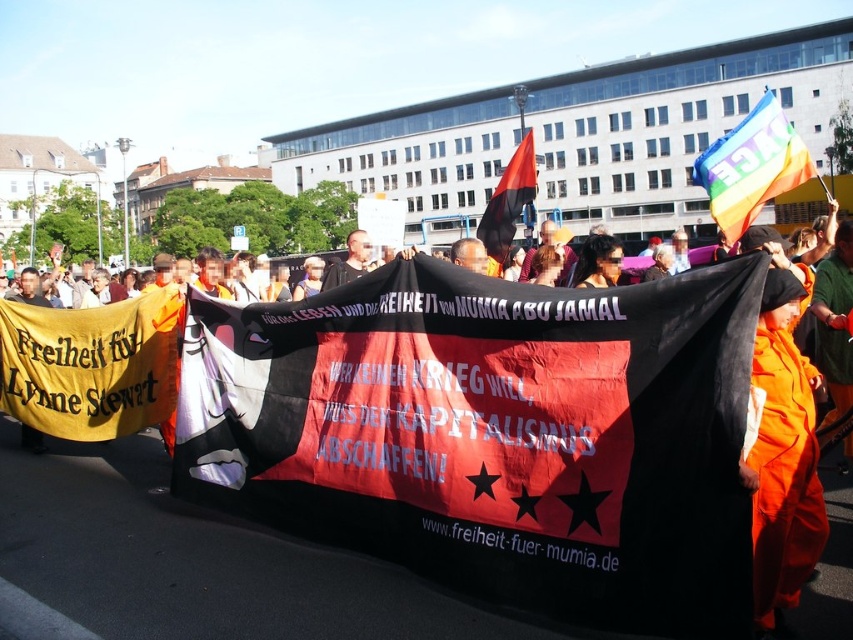
Question: Does orange jumpsuit at center have a smaller size compared to rainbow fabric flag at upper right?

Choices:
 (A) yes
 (B) no

Answer: (A)

Question: Among these objects, which one is farthest from the camera?

Choices:
 (A) red fabric flag at center
 (B) rainbow fabric flag at upper right
 (C) orange jumpsuit at center

Answer: (A)

Question: Is orange jumpsuit at center positioned at the back of red fabric flag at center?

Choices:
 (A) no
 (B) yes

Answer: (A)

Question: Is orange jumpsuit at center positioned before rainbow fabric flag at upper right?

Choices:
 (A) no
 (B) yes

Answer: (B)

Question: Which point appears farthest from the camera in this image?

Choices:
 (A) (804, 172)
 (B) (529, 129)
 (C) (766, 586)

Answer: (B)

Question: Estimate the real-world distances between objects in this image. Which object is farther from the rainbow fabric flag at upper right?

Choices:
 (A) orange jumpsuit at center
 (B) red fabric flag at center

Answer: (B)